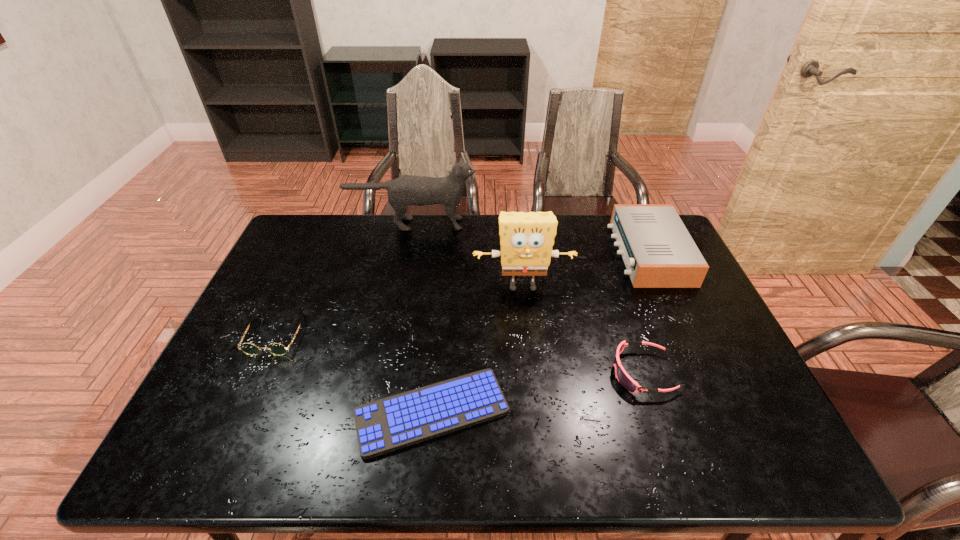
I want to click on object that is at the right edge, so click(x=658, y=251).

Find the location of `object present at the far right corner`. object present at the far right corner is located at coordinates (658, 251).

At what (x,y) coordinates should I click in order to perform the action: click on free space at the far edge. Please return your answer as a coordinate pair (x, y). This screenshot has height=540, width=960. Looking at the image, I should click on (489, 224).

Where is `vacant space at the near edge of the desktop`? vacant space at the near edge of the desktop is located at coordinates (685, 461).

Find the location of a particular element. Image resolution: width=960 pixels, height=540 pixels. vacant space at the left edge is located at coordinates (279, 324).

The image size is (960, 540). What are the coordinates of `vacant space at the right edge of the desktop` in the screenshot? It's located at (762, 404).

Where is `free area in between the leftmost object and the cat`? free area in between the leftmost object and the cat is located at coordinates (344, 280).

Image resolution: width=960 pixels, height=540 pixels. In order to click on empty space between the cat and the sponge in this screenshot , I will do `click(468, 255)`.

Locate an element on the screen. This screenshot has width=960, height=540. free spot between the computer keyboard and the fourth shortest object is located at coordinates (540, 333).

Image resolution: width=960 pixels, height=540 pixels. I want to click on vacant point located between the sponge and the cat, so click(x=468, y=255).